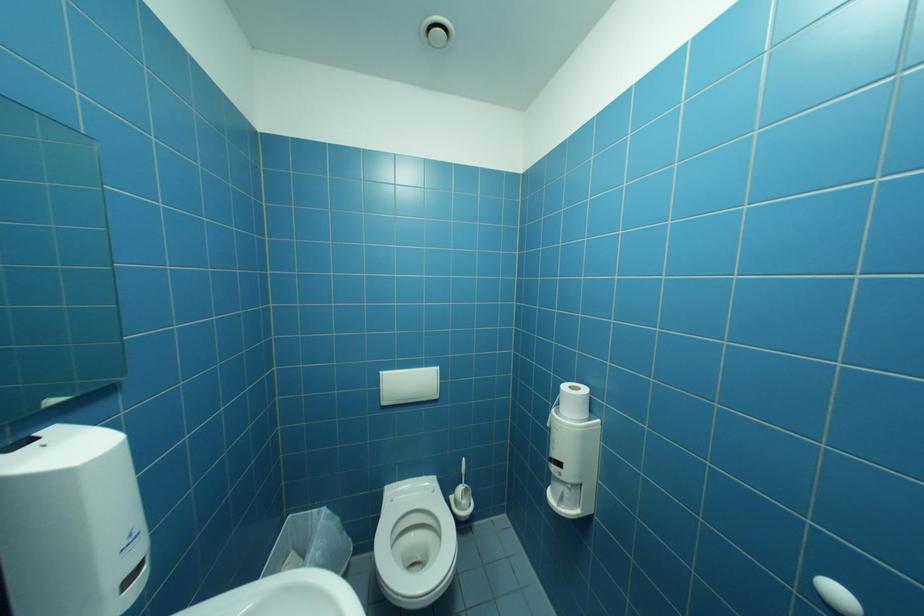
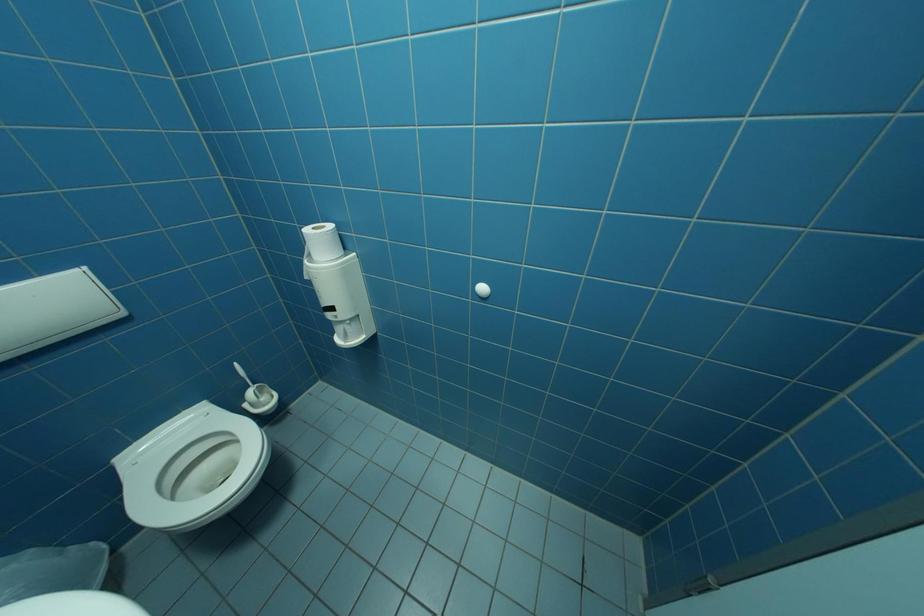
From the picture: The first image is from the beginning of the video and the second image is from the end. How did the camera likely rotate when shooting the video?

The camera rotated toward right-down.